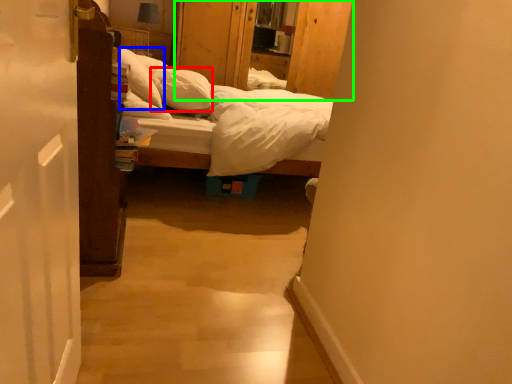
Question: Which object is positioned farthest from pillow (highlighted by a red box)? Select from pillow (highlighted by a blue box) and dresser (highlighted by a green box).

Choices:
 (A) pillow
 (B) dresser

Answer: (B)